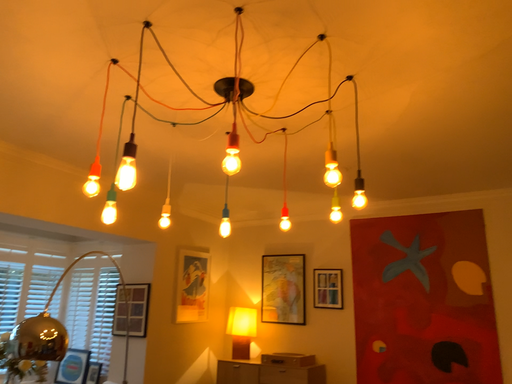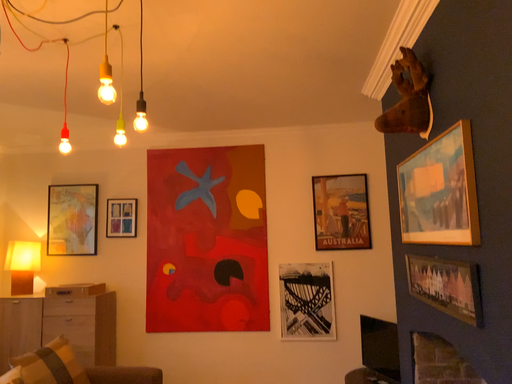
Question: How did the camera likely rotate when shooting the video?

Choices:
 (A) rotated left
 (B) rotated right

Answer: (B)